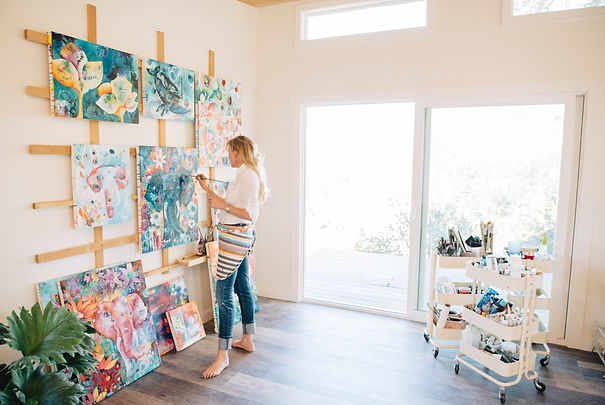
The width and height of the screenshot is (605, 405). In order to click on plant in this screenshot , I will do `click(54, 339)`.